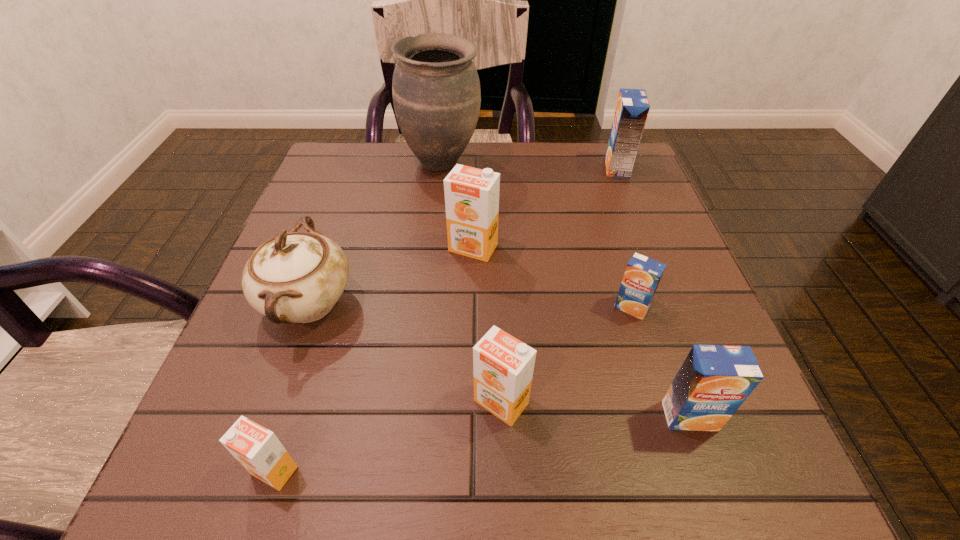
Identify which orange orange juice is the closest to the farthest orange orange juice. Please provide its 2D coordinates. Your answer should be formatted as a tuple, i.e. [(x, y)], where the tuple contains the x and y coordinates of a point satisfying the conditions above.

[(503, 366)]

Where is `free space that satisfies the following two spatial constraints: 1. on the front side of the second smallest orange orange juice; 2. on the left side of the biggest orange orange juice`? This screenshot has width=960, height=540. free space that satisfies the following two spatial constraints: 1. on the front side of the second smallest orange orange juice; 2. on the left side of the biggest orange orange juice is located at coordinates (470, 402).

This screenshot has width=960, height=540. In order to click on free spot that satisfies the following two spatial constraints: 1. on the back side of the chinaware; 2. on the right side of the fifth nearest orange juice in this screenshot , I will do coord(328,248).

I want to click on vacant area that satisfies the following two spatial constraints: 1. on the front side of the leftmost orange orange juice; 2. on the right side of the chinaware, so click(x=250, y=470).

Find the location of a particular element. vacant space that satisfies the following two spatial constraints: 1. on the back side of the chinaware; 2. on the left side of the second farthest orange juice is located at coordinates (328, 248).

Image resolution: width=960 pixels, height=540 pixels. Identify the location of free spot that satisfies the following two spatial constraints: 1. on the front side of the chinaware; 2. on the right side of the third farthest orange juice. (307, 307).

Identify the location of free space that satisfies the following two spatial constraints: 1. on the front side of the second biggest blue orange_juice; 2. on the right side of the second farthest orange orange juice. This screenshot has height=540, width=960. (502, 416).